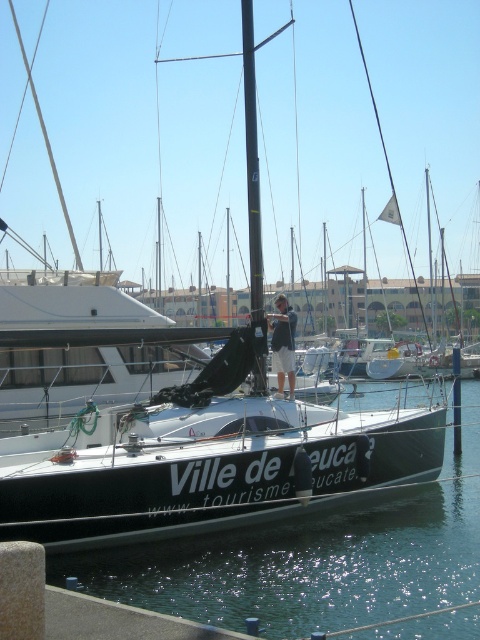
You are a photographer standing at the camera position. You want to capture a reflection of the clear water at center in your shot. Since the water is calm, you know reflections are clear when the camera is positioned exactly at the water level. Is your current position at water level?

The clear water at center and camera are 8.11 meters apart from each other. Since reflections are clear when the camera is at water level, but the distance between them is 8.11 meters, this suggests the camera is not at water level. Therefore, the photographer is not at water level.

Looking at this image, you are a photographer standing on the pier and want to take a photo of the dark blue shorts at center and the clear water at center. Which object is positioned to the right side of the other?

The clear water at center is to the right of dark blue shorts at center, so the clear water at center is positioned to the right side of the dark blue shorts at center.